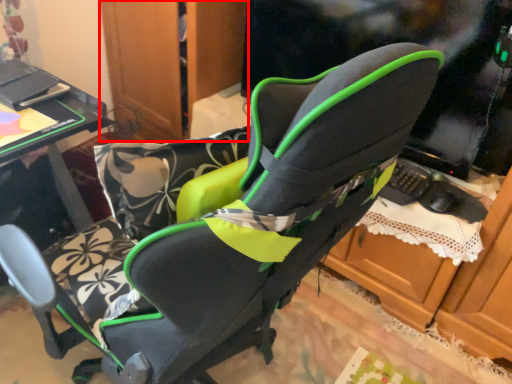
Question: Observing the image, what is the correct spatial positioning of dresser (annotated by the red box) in reference to table?

Choices:
 (A) left
 (B) right

Answer: (B)